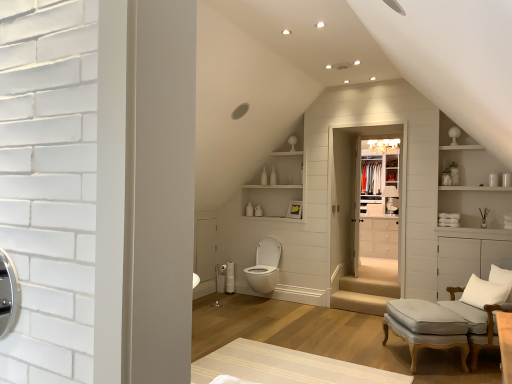
Where is `vacant space situated above clear glass closet door at center (from a real-world perspective)`? The image size is (512, 384). vacant space situated above clear glass closet door at center (from a real-world perspective) is located at coordinates (366, 121).